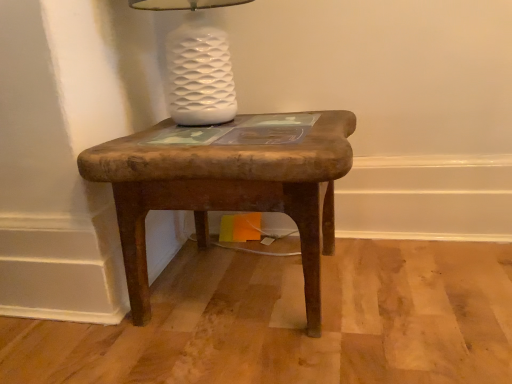
Where is `free point in front of white glossy lamp at upper center`? free point in front of white glossy lamp at upper center is located at coordinates (206, 144).